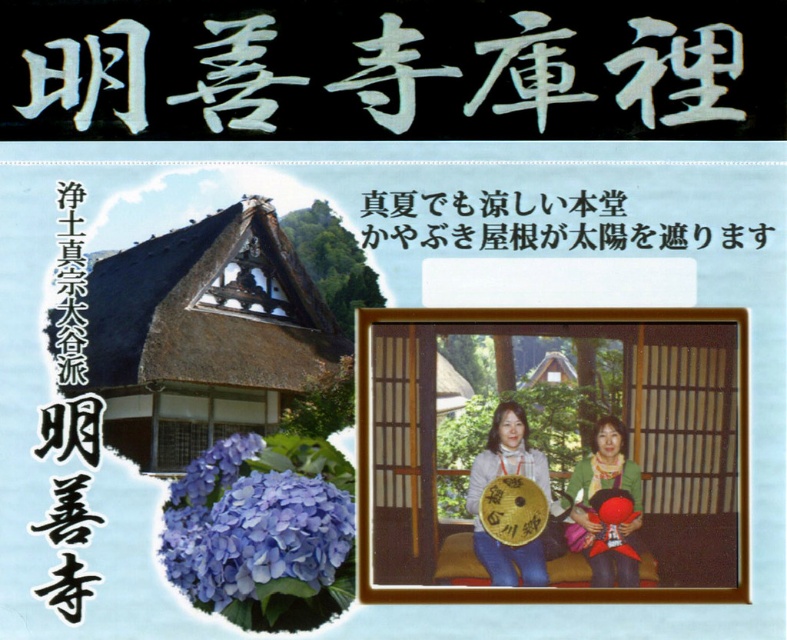
Question: Is white paper at upper center above matte gold umbrella at center?

Choices:
 (A) no
 (B) yes

Answer: (B)

Question: Which point is farther to the camera?

Choices:
 (A) purple matte hydrangea at lower left
 (B) white paper at upper center

Answer: (B)

Question: Can you confirm if purple matte hydrangea at lower left is positioned below black paper at upper center?

Choices:
 (A) yes
 (B) no

Answer: (A)

Question: Among these points, which one is nearest to the camera?

Choices:
 (A) (630, 465)
 (B) (499, 436)

Answer: (B)

Question: Considering the relative positions of purple matte hydrangea at lower left and matte gold umbrella at center in the image provided, where is purple matte hydrangea at lower left located with respect to matte gold umbrella at center?

Choices:
 (A) above
 (B) below

Answer: (B)

Question: Which point appears farthest from the camera in this image?

Choices:
 (A) (260, 499)
 (B) (142, 433)
 (C) (478, 196)

Answer: (B)